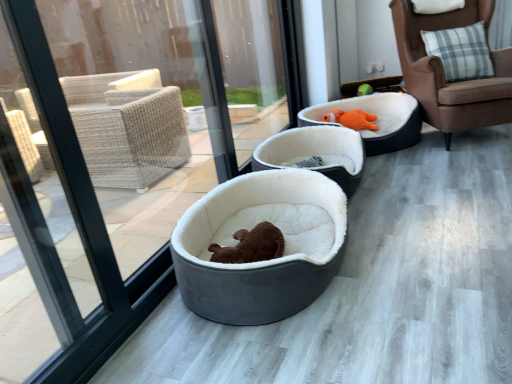
Question: Could velvet orange plush bed at center, which is the third dog bed in front-to-back order, be considered to be inside orange plush toy at upper right?

Choices:
 (A) no
 (B) yes

Answer: (A)

Question: Can you confirm if orange plush toy at upper right is bigger than velvet orange plush bed at center, which is the third dog bed in front-to-back order?

Choices:
 (A) yes
 (B) no

Answer: (B)

Question: Is orange plush toy at upper right smaller than velvet orange plush bed at center, acting as the 1th dog bed starting from the back?

Choices:
 (A) yes
 (B) no

Answer: (A)

Question: Is orange plush toy at upper right positioned in front of velvet orange plush bed at center, acting as the 1th dog bed starting from the back?

Choices:
 (A) yes
 (B) no

Answer: (B)

Question: From the image's perspective, is orange plush toy at upper right on velvet orange plush bed at center, which is the third dog bed in front-to-back order?

Choices:
 (A) yes
 (B) no

Answer: (A)

Question: Does orange plush toy at upper right appear on the left side of velvet orange plush bed at center, which is the third dog bed in front-to-back order?

Choices:
 (A) no
 (B) yes

Answer: (B)

Question: Is velvet orange plush bed at center, acting as the 1th dog bed starting from the back, smaller than soft white fur bed at center, positioned as the 2th dog bed in back-to-front order?

Choices:
 (A) yes
 (B) no

Answer: (B)

Question: Can you confirm if velvet orange plush bed at center, acting as the 1th dog bed starting from the back, is wider than soft white fur bed at center, positioned as the 2th dog bed in back-to-front order?

Choices:
 (A) yes
 (B) no

Answer: (A)

Question: From a real-world perspective, is velvet orange plush bed at center, which is the third dog bed in front-to-back order, on soft white fur bed at center, positioned as the 2th dog bed in back-to-front order?

Choices:
 (A) no
 (B) yes

Answer: (B)

Question: Is velvet orange plush bed at center, acting as the 1th dog bed starting from the back, to the left of soft white fur bed at center, positioned as the 2th dog bed in back-to-front order, from the viewer's perspective?

Choices:
 (A) yes
 (B) no

Answer: (B)

Question: Considering the relative sizes of velvet orange plush bed at center, which is the third dog bed in front-to-back order, and soft white fur bed at center, positioned as the 2th dog bed in back-to-front order, in the image provided, is velvet orange plush bed at center, which is the third dog bed in front-to-back order, bigger than soft white fur bed at center, positioned as the 2th dog bed in back-to-front order,?

Choices:
 (A) yes
 (B) no

Answer: (A)

Question: Is velvet orange plush bed at center, which is the third dog bed in front-to-back order, turned away from soft white fur bed at center, positioned as the 2th dog bed in back-to-front order?

Choices:
 (A) no
 (B) yes

Answer: (A)

Question: Can you confirm if brown leather chair at right is positioned to the left of orange plush toy at upper right?

Choices:
 (A) yes
 (B) no

Answer: (B)